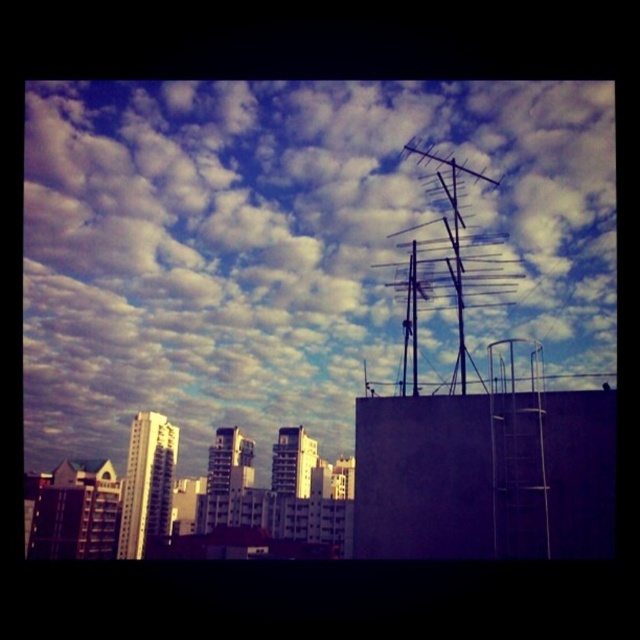
You are an architect reviewing a city design. You notice the cloudy sky at upper center and the metallic antenna at upper right. Which of these two elements occupies a taller vertical space in the scene?

The cloudy sky at upper center has a greater height compared to the metallic antenna at upper right, so the cloudy sky at upper center occupies a taller vertical space in the scene.

You are a drone operator trying to navigate a delivery drone through the city. You need to avoid obstacles and ensure safe passage. The drone is currently at the point marked as point (284, 244). According to the image, what is the immediate obstacle directly above this point that the drone must avoid?

The point (284, 244) indicates cloudy sky at upper center, so the immediate obstacle directly above this point that the drone must avoid is the cloudy sky at upper center.